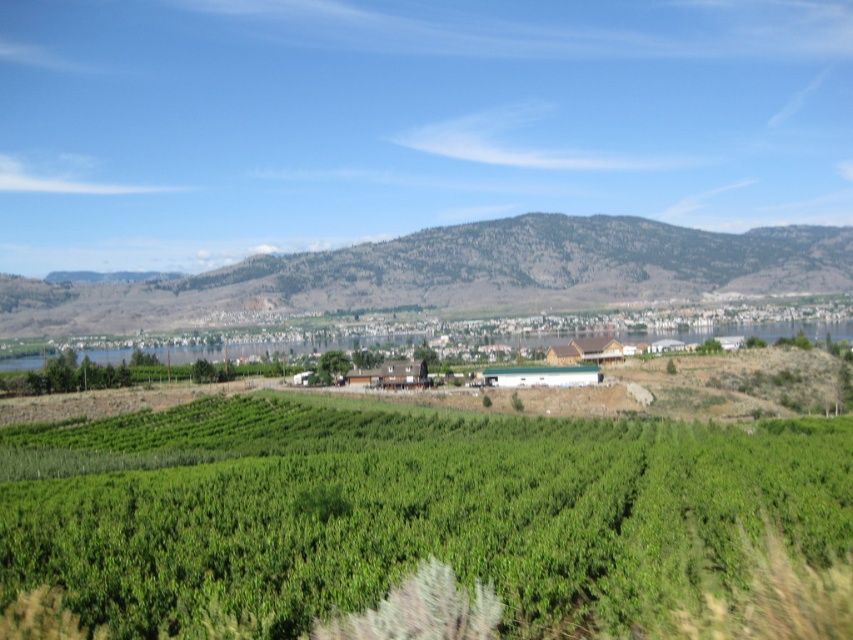
You are an aerial photographer planning to capture the green leafy vineyard at center and the rocky gray mountain at center. Based on the scene, which object is positioned to the left when viewed from above?

The green leafy vineyard at center is to the left of the rocky gray mountain at center, so it is positioned to the left when viewed from above.

You are a landscape photographer planning to capture the entire scene in one shot. Given that your camera can only focus on objects with a width of at least 10 meters, will both the green leafy vineyard at center and the rocky gray mountain at center be in focus? Please explain your reasoning.

The green leafy vineyard at center has a lesser width compared to the rocky gray mountain at center. Since the vineyard is narrower than the mountain, if the mountain meets the 10 meter width requirement, the vineyard might be too narrow to focus. However, without exact measurements, it is uncertain. The answer depends on whether the vineyard is at least 10 meters wide.

You are standing in the vineyard looking towards the town. There are two points marked in the image, one at coordinate point (833, 528) and another at point (292, 310). Which point is closer to you?

Point (833, 528) is closer to the viewer than point (292, 310).